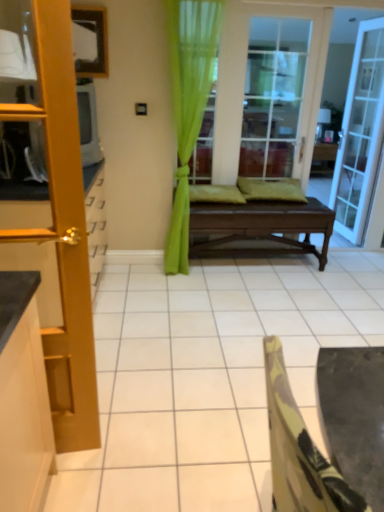
Question: From a real-world perspective, is dark brown wooden bench at center above or below wooden door at left, which is the second door in right-to-left order?

Choices:
 (A) below
 (B) above

Answer: (A)

Question: In terms of size, does dark brown wooden bench at center appear bigger or smaller than wooden door at left, the 1th door in the left-to-right sequence?

Choices:
 (A) small
 (B) big

Answer: (B)

Question: Estimate the real-world distances between objects in this image. Which object is closer to the dark brown wooden bench at center?

Choices:
 (A) clear glass door at upper right, marked as the 1th door in a right-to-left arrangement
 (B) wooden door at left, which is the second door in right-to-left order
 (C) camouflage fabric chair at lower right
 (D) clear glass door at center
 (E) green sheer curtain at center

Answer: (E)

Question: Which object is the farthest from the clear glass door at center?

Choices:
 (A) clear glass door at upper right, the 2th door positioned from the front
 (B) dark brown wooden bench at center
 (C) wooden door at left, the 1th door in the left-to-right sequence
 (D) green sheer curtain at center
 (E) camouflage fabric chair at lower right

Answer: (E)